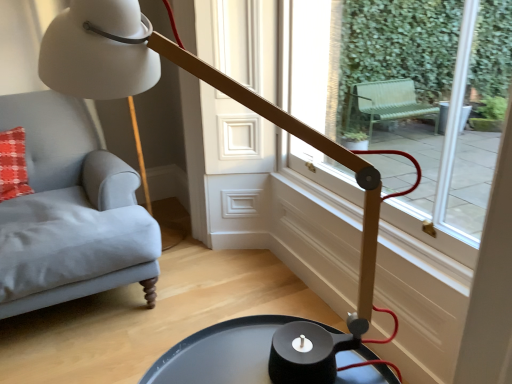
At what (x,y) coordinates should I click in order to perform the action: click on black matte tray at lower center. Please return your answer as a coordinate pair (x, y). Image resolution: width=512 pixels, height=384 pixels. Looking at the image, I should click on (221, 354).

The height and width of the screenshot is (384, 512). Describe the element at coordinates (221, 354) in the screenshot. I see `black matte tray at lower center` at that location.

The image size is (512, 384). I want to click on transparent glass window at center, so click(x=437, y=150).

Measure the distance between transparent glass window at center and camera.

5.14 feet.

Image resolution: width=512 pixels, height=384 pixels. What do you see at coordinates (437, 150) in the screenshot? I see `transparent glass window at center` at bounding box center [437, 150].

The height and width of the screenshot is (384, 512). I want to click on black matte tray at lower center, so (x=221, y=354).

Based on the photo, considering the relative positions of transparent glass window at center and black matte tray at lower center in the image provided, is transparent glass window at center to the left of black matte tray at lower center from the viewer's perspective?

No.

Is transparent glass window at center in front of or behind black matte tray at lower center in the image?

In the image, transparent glass window at center appears behind black matte tray at lower center.

Does point (387, 140) come farther from viewer compared to point (189, 383)?

Yes, it is behind point (189, 383).

From the image's perspective, between transparent glass window at center and black matte tray at lower center, which one is located above?

transparent glass window at center, from the image's perspective.

From a real-world perspective, is transparent glass window at center located higher than black matte tray at lower center?

Correct, in the physical world, transparent glass window at center is higher than black matte tray at lower center.

In the scene shown: Considering the sizes of objects transparent glass window at center and black matte tray at lower center in the image provided, who is wider, transparent glass window at center or black matte tray at lower center?

With larger width is black matte tray at lower center.

Can you confirm if transparent glass window at center is taller than black matte tray at lower center?

Correct, transparent glass window at center is much taller as black matte tray at lower center.

Who is bigger, transparent glass window at center or black matte tray at lower center?

transparent glass window at center is bigger.

Could black matte tray at lower center be considered to be inside transparent glass window at center?

No.

Is transparent glass window at center placed right next to black matte tray at lower center?

No, transparent glass window at center is not next to black matte tray at lower center.

Is transparent glass window at center oriented away from black matte tray at lower center?

That's not correct — transparent glass window at center is not looking away from black matte tray at lower center.

How different are the orientations of transparent glass window at center and black matte tray at lower center in degrees?

0.331 degrees separate the facing orientations of transparent glass window at center and black matte tray at lower center.

Locate an element on the screen. window lying above the black matte tray at lower center (from the image's perspective) is located at coordinates (437, 150).

Can you confirm if black matte tray at lower center is positioned to the right of transparent glass window at center?

In fact, black matte tray at lower center is to the left of transparent glass window at center.

Which object is more forward, black matte tray at lower center or transparent glass window at center?

Positioned in front is black matte tray at lower center.

Which point is more distant from viewer, (202, 363) or (409, 168)?

The point (409, 168) is behind.

From the image's perspective, is black matte tray at lower center below transparent glass window at center?

Yes, from the image's perspective, black matte tray at lower center is below transparent glass window at center.

From a real-world perspective, is black matte tray at lower center below transparent glass window at center?

Indeed, from a real-world perspective, black matte tray at lower center is positioned beneath transparent glass window at center.

Considering the relative sizes of black matte tray at lower center and transparent glass window at center in the image provided, is black matte tray at lower center thinner than transparent glass window at center?

Incorrect, the width of black matte tray at lower center is not less than that of transparent glass window at center.

Is black matte tray at lower center taller than transparent glass window at center?

No.

Can you confirm if black matte tray at lower center is smaller than transparent glass window at center?

Indeed, black matte tray at lower center has a smaller size compared to transparent glass window at center.

Is black matte tray at lower center inside the boundaries of transparent glass window at center, or outside?

black matte tray at lower center is outside transparent glass window at center.

Is the surface of black matte tray at lower center in direct contact with transparent glass window at center?

black matte tray at lower center and transparent glass window at center are not in contact.

Is black matte tray at lower center turned away from transparent glass window at center?

black matte tray at lower center is not turned away from transparent glass window at center.

At what (x,y) coordinates should I click in order to perform the action: click on window above the black matte tray at lower center (from the image's perspective). Please return your answer as a coordinate pair (x, y). Looking at the image, I should click on (437, 150).

Image resolution: width=512 pixels, height=384 pixels. Find the location of `window located above the black matte tray at lower center (from the image's perspective)`. window located above the black matte tray at lower center (from the image's perspective) is located at coordinates click(x=437, y=150).

Identify the location of table directly beneath the transparent glass window at center (from a real-world perspective). Image resolution: width=512 pixels, height=384 pixels. (221, 354).